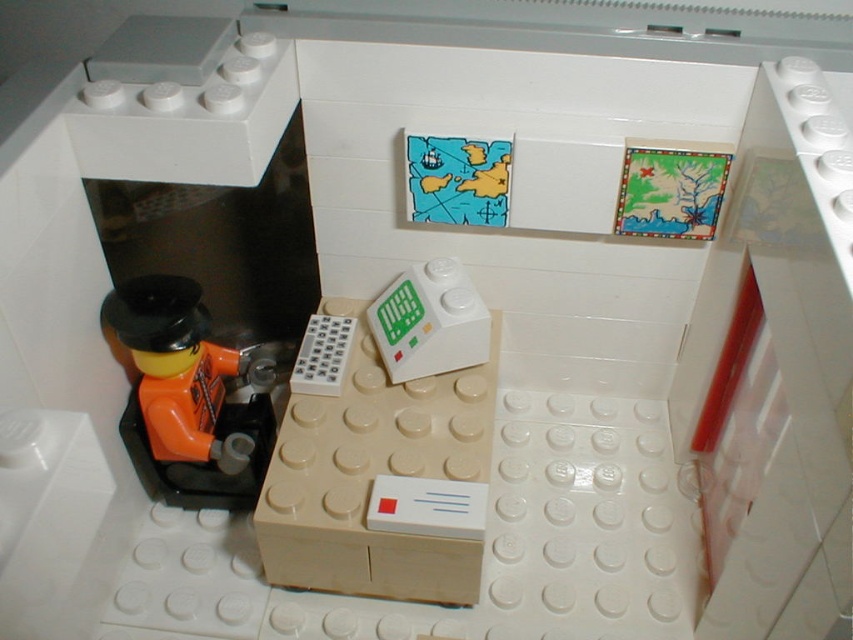
You are a LEGO figure standing at the entrance of the cabin. You see the beige plastic drawer at center and the white plastic remote at lower left. Which object is closer to your right side?

The beige plastic drawer at center is positioned on the right side of the white plastic remote at lower left, so it is closer to your right side.

You are a LEGO figure standing at the bottom left corner of the image. You need to reach the beige plastic drawer at center. Which direction should you move first? Please answer with either North, South, East, or West.

The beige plastic drawer at center is located at point [389,452]. Since you are at the bottom left corner, moving East would be the first direction to head towards the beige plastic drawer at center.